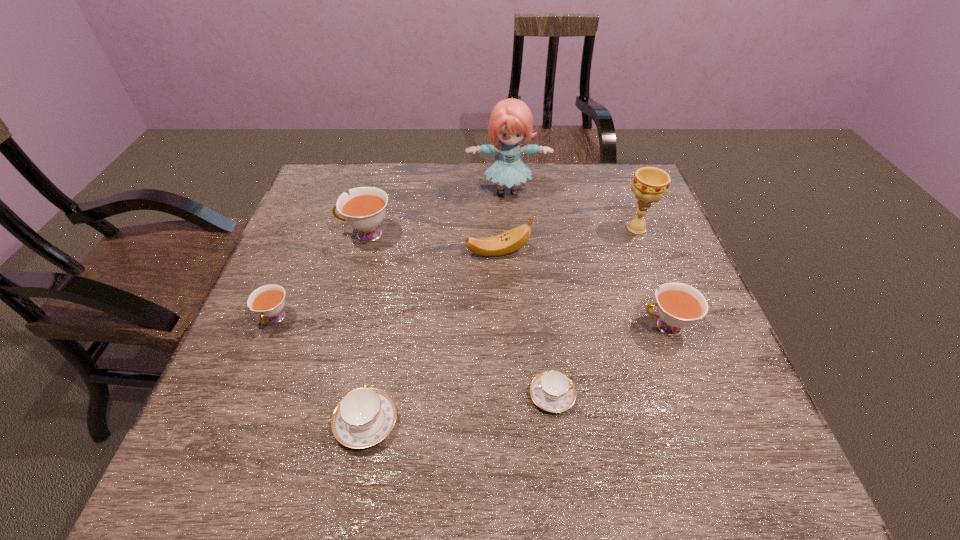
Where is `vacant space situated 0.170m on the side of the second tallest teacup with the handle`? Image resolution: width=960 pixels, height=540 pixels. vacant space situated 0.170m on the side of the second tallest teacup with the handle is located at coordinates (563, 327).

Find the location of a particular element. The image size is (960, 540). vacant space located 0.280m on the side of the smallest white teacup with the handle is located at coordinates (216, 463).

Find the location of a particular element. free space located 0.070m on the side with the handle of the bigger blue teacup is located at coordinates (377, 363).

I want to click on vacant region located 0.100m on the side with the handle of the bigger blue teacup, so click(x=379, y=351).

Identify the location of free space located on the side with the handle of the bigger blue teacup. (396, 266).

Find the location of a particular element. The width and height of the screenshot is (960, 540). free space located on the side with the handle of the shortest object is located at coordinates (717, 395).

I want to click on object situated at the far edge, so click(x=511, y=121).

The width and height of the screenshot is (960, 540). Identify the location of object that is at the near edge. (365, 416).

You are a GUI agent. You are given a task and a screenshot of the screen. Output one action in this format:
    pyautogui.click(x=<x>, y=<y>)
    Task: Click on the chalice located in the right edge section of the desktop
    The width and height of the screenshot is (960, 540).
    Given the screenshot: What is the action you would take?
    pyautogui.click(x=650, y=184)

The width and height of the screenshot is (960, 540). I want to click on teacup that is at the right edge, so pos(679,305).